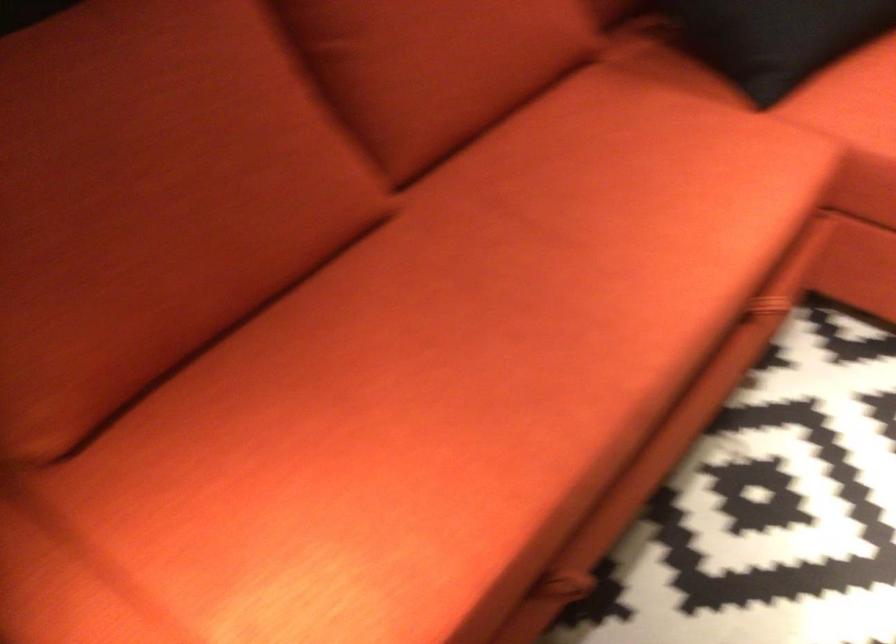
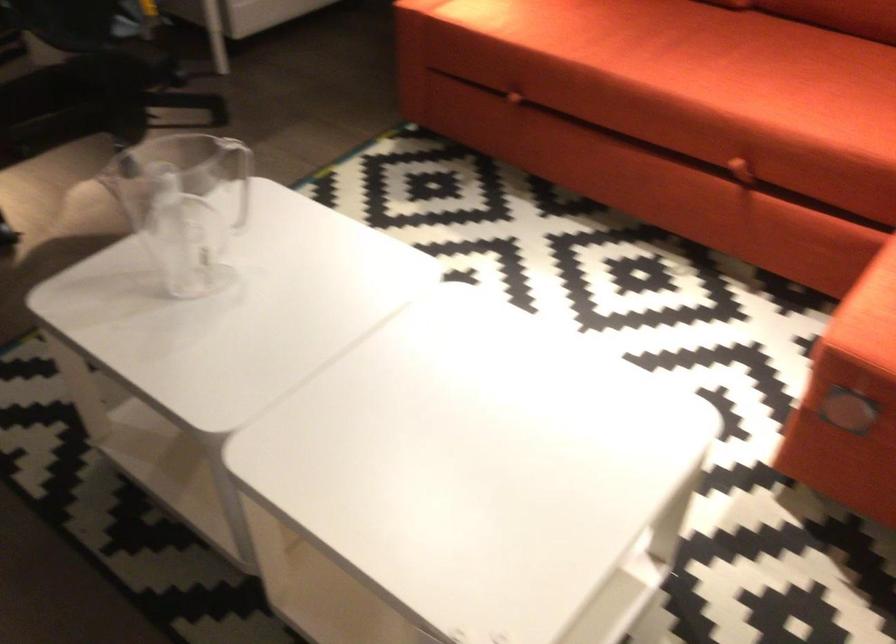
Find the pixel in the second image that matches pixel 757 310 in the first image.

(737, 160)